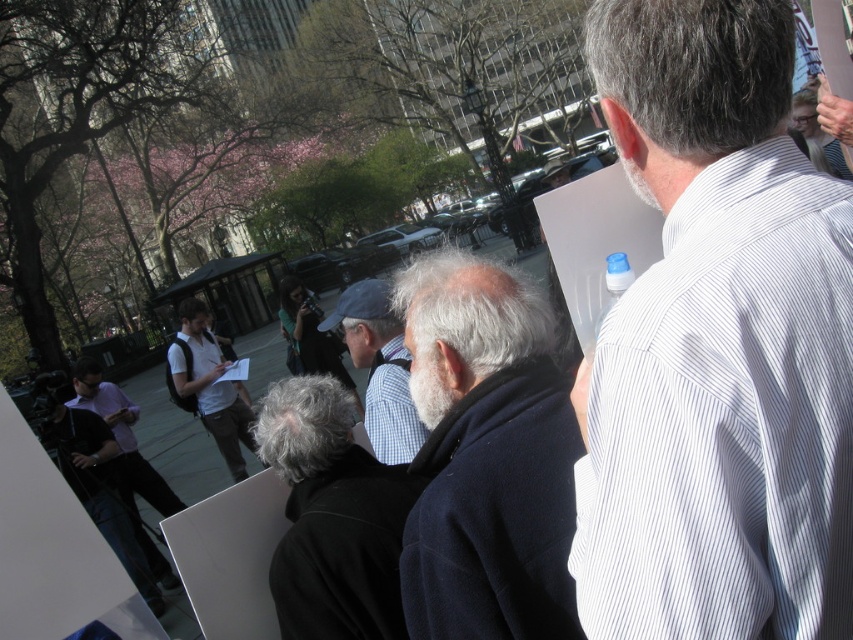
You are standing at the origin point of the image coordinate system. The image coordinate system has the origin at the bottom left corner. You need to move to the dark gray wool coat at center. What direction should you move in?

Since the dark gray wool coat at center is at point (x=332, y=516) in the image coordinate system, which has the origin at the bottom left corner, you should move to the right and slightly upwards to reach it.

You are a photographer at the event and want to capture both the dark gray wool coat at center and the matte black shirt at lower left in a single shot. Which subject should you focus on first to ensure both are in frame?

The dark gray wool coat at center is above the matte black shirt at lower left, so focusing on the dark gray wool coat at center first will ensure both are within the frame.